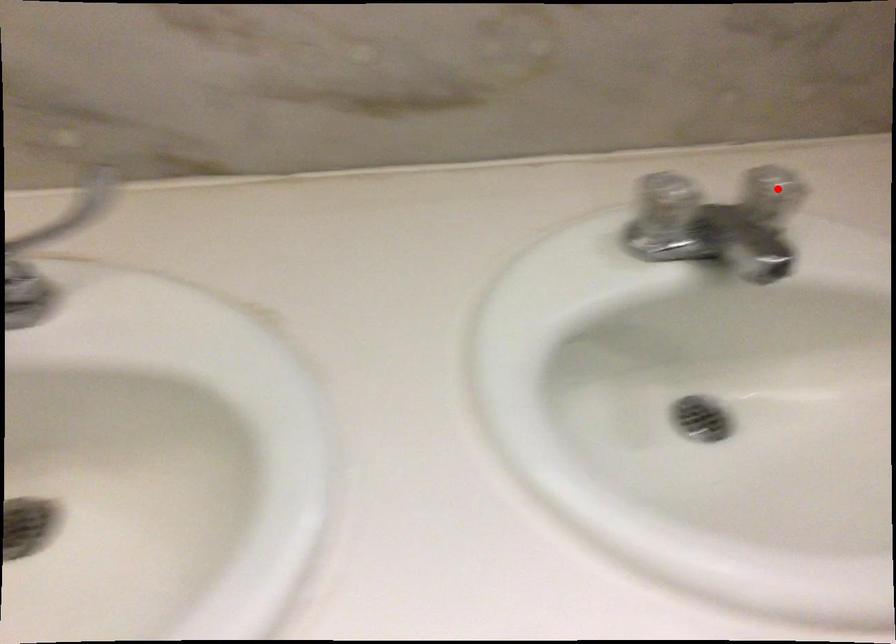
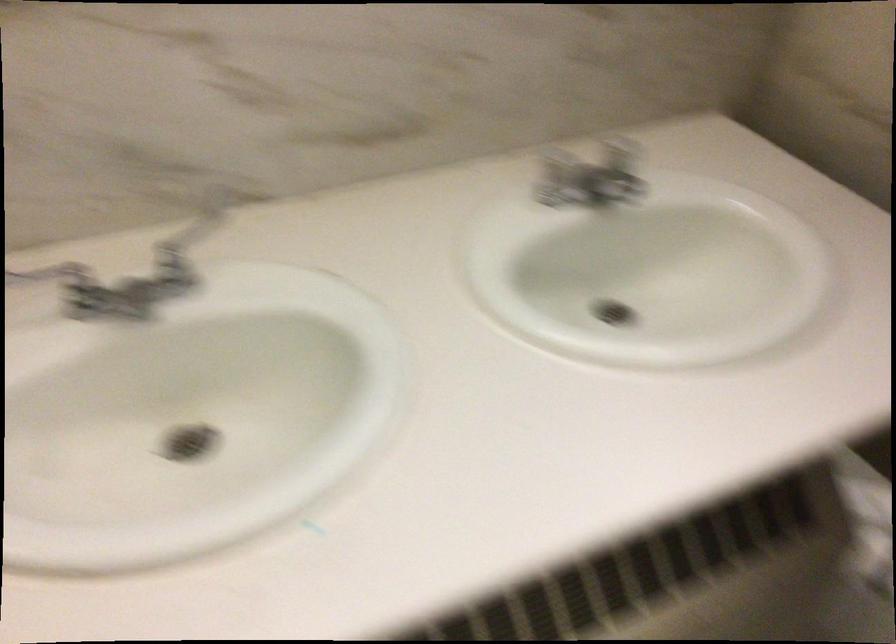
Question: I am providing you with two images of the same scene from different viewpoints. In image1, a red point is highlighted. Considering the same 3D point in image2, which of the following is correct?

Choices:
 (A) It is closer
 (B) It is farther

Answer: (B)